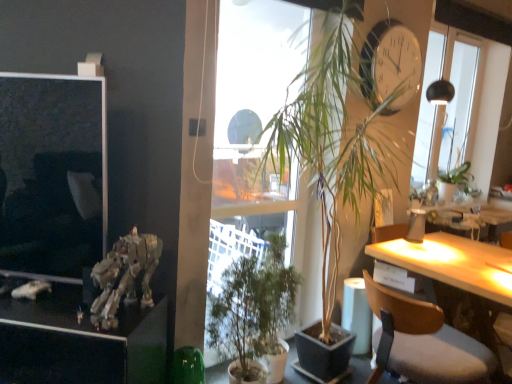
At what (x,y) coordinates should I click in order to perform the action: click on vacant point above metallic silver robot at left (from a real-world perspective). Please return your answer as a coordinate pair (x, y). The height and width of the screenshot is (384, 512). Looking at the image, I should click on (53, 309).